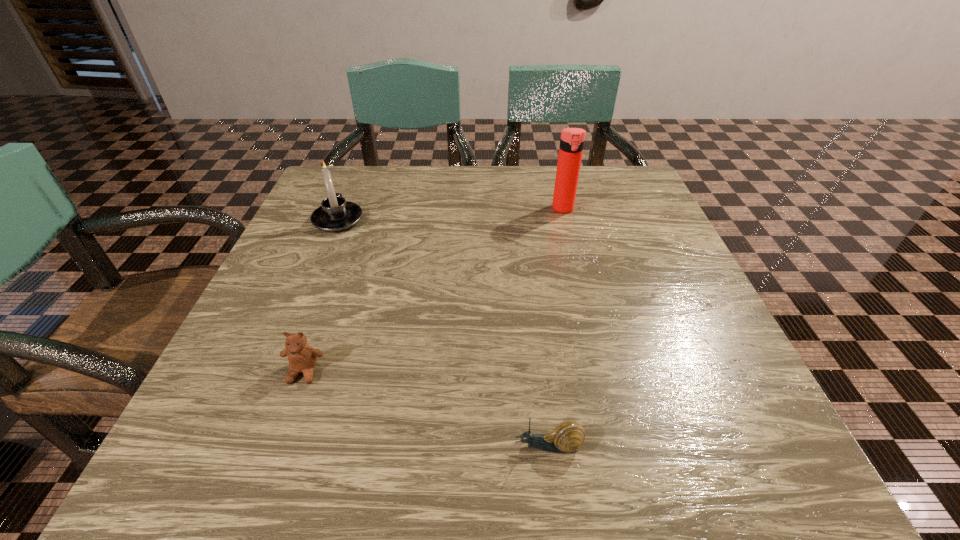
Identify the location of vacant space that's between the tallest object and the teddy bear. The height and width of the screenshot is (540, 960). (434, 291).

What are the coordinates of `unoccupied position between the third shortest object and the teddy bear` in the screenshot? It's located at (321, 296).

Find the location of a particular element. The image size is (960, 540). free space between the third shortest object and the tallest object is located at coordinates (450, 214).

Image resolution: width=960 pixels, height=540 pixels. Find the location of `free area in between the teddy bear and the rightmost object`. free area in between the teddy bear and the rightmost object is located at coordinates (x=434, y=291).

Locate an element on the screen. The width and height of the screenshot is (960, 540). free space between the candle holder and the tallest object is located at coordinates (450, 214).

At what (x,y) coordinates should I click in order to perform the action: click on object that is the second nearest to the tallest object. Please return your answer as a coordinate pair (x, y). Looking at the image, I should click on (568, 436).

At what (x,y) coordinates should I click in order to perform the action: click on the closest object to the nearest object. Please return your answer as a coordinate pair (x, y). The height and width of the screenshot is (540, 960). Looking at the image, I should click on (302, 358).

Find the location of `free space that satisfies the following two spatial constraints: 1. with a handle on the side of the third shortest object; 2. on the left side of the tallest object`. free space that satisfies the following two spatial constraints: 1. with a handle on the side of the third shortest object; 2. on the left side of the tallest object is located at coordinates (343, 209).

At what (x,y) coordinates should I click in order to perform the action: click on vacant space that satisfies the following two spatial constraints: 1. with a handle on the side of the candle holder; 2. on the left side of the thermos bottle. Please return your answer as a coordinate pair (x, y). This screenshot has width=960, height=540. Looking at the image, I should click on (343, 209).

What are the coordinates of `vacant position in the image that satisfies the following two spatial constraints: 1. on the front side of the rightmost object; 2. on the front-facing side of the escargot` in the screenshot? It's located at (623, 446).